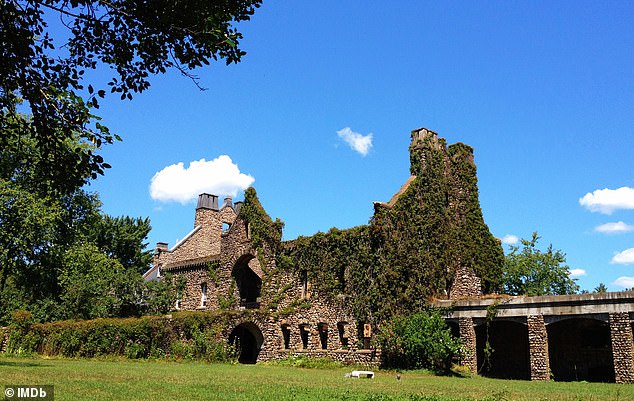
The height and width of the screenshot is (401, 634). I want to click on window, so click(x=370, y=333), click(x=347, y=330), click(x=325, y=330), click(x=306, y=333), click(x=283, y=337), click(x=302, y=285), click(x=200, y=300), click(x=179, y=301).